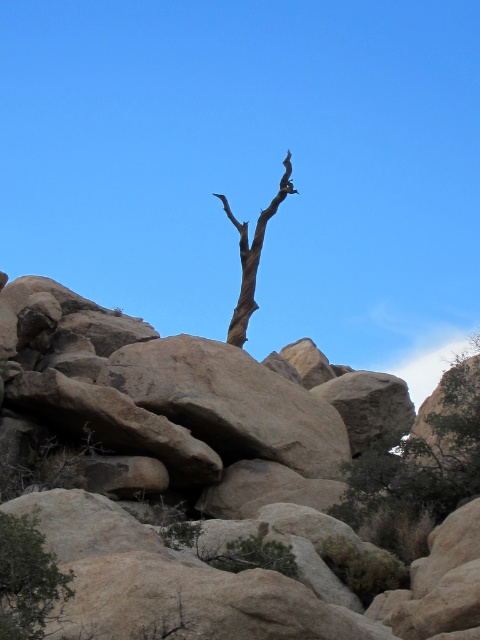
You are a hiker trying to navigate through the arid landscape. You see a green leafy tree at right and a brown bark tree at center. Which tree would appear larger to you from your current position?

The green leafy tree at right appears larger because it is closer to the viewer than the brown bark tree at center.

In the scene shown: You are standing at the center of the arid landscape and want to water the green leafy shrub at lower left. If your watering can holds enough water for a 5 meter walk, can you reach the shrub without refilling?

The green leafy shrub at lower left is 6.81 meters away from the viewer. Since the watering can only allows a 5 meter walk, you cannot reach the shrub without refilling.

You are a hiker who wants to take a photo of the brown bark tree at center without the brown rough rock at upper center blocking the view. Which direction should you move to ensure the tree is visible without the rock in front?

Move to the side so that the brown rough rock at upper center is no longer in front of the brown bark tree at center. Since the rock is in front of the tree, moving sideways either left or right would allow you to position yourself where the rock is out of the frame or behind you, revealing the tree unobstructed.